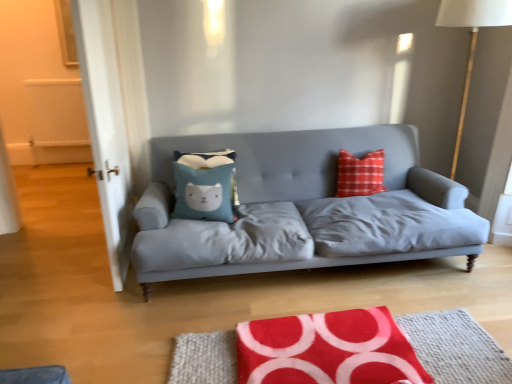
The width and height of the screenshot is (512, 384). Find the location of `free point above red fabric rug at lower center (from a real-world perspective)`. free point above red fabric rug at lower center (from a real-world perspective) is located at coordinates (333, 354).